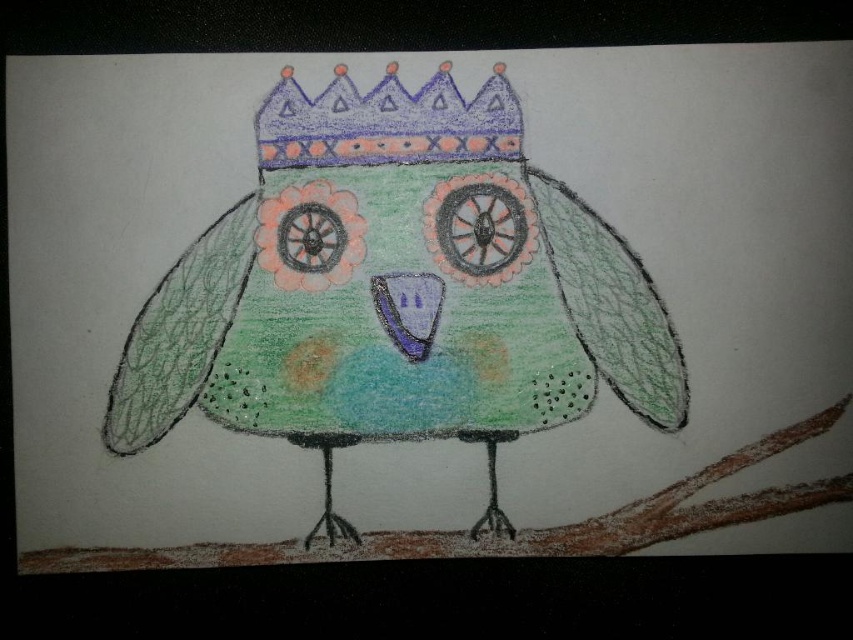
Question: Does pastel green paper bird at center appear over purple crayon crown at upper center?

Choices:
 (A) no
 (B) yes

Answer: (A)

Question: Is pastel green paper bird at center bigger than purple crayon crown at upper center?

Choices:
 (A) no
 (B) yes

Answer: (B)

Question: Which point is farther to the camera?

Choices:
 (A) pastel green paper bird at center
 (B) purple crayon crown at upper center

Answer: (B)

Question: Is pastel green paper bird at center thinner than purple crayon crown at upper center?

Choices:
 (A) no
 (B) yes

Answer: (A)